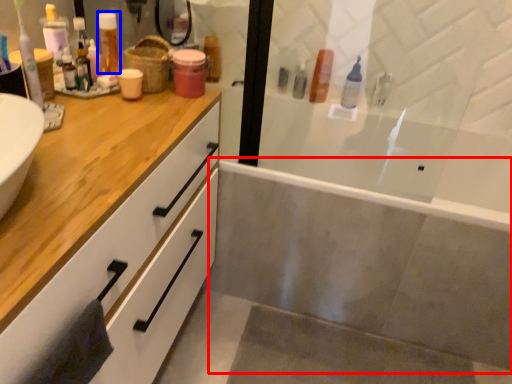
Question: Which object is closer to the camera taking this photo, bath (highlighted by a red box) or toiletry (highlighted by a blue box)?

Choices:
 (A) bath
 (B) toiletry

Answer: (B)